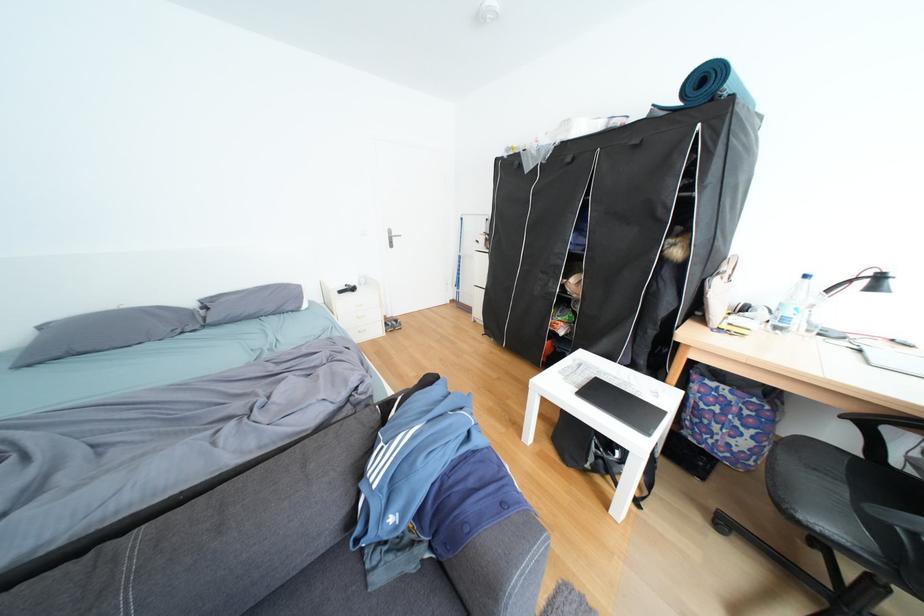
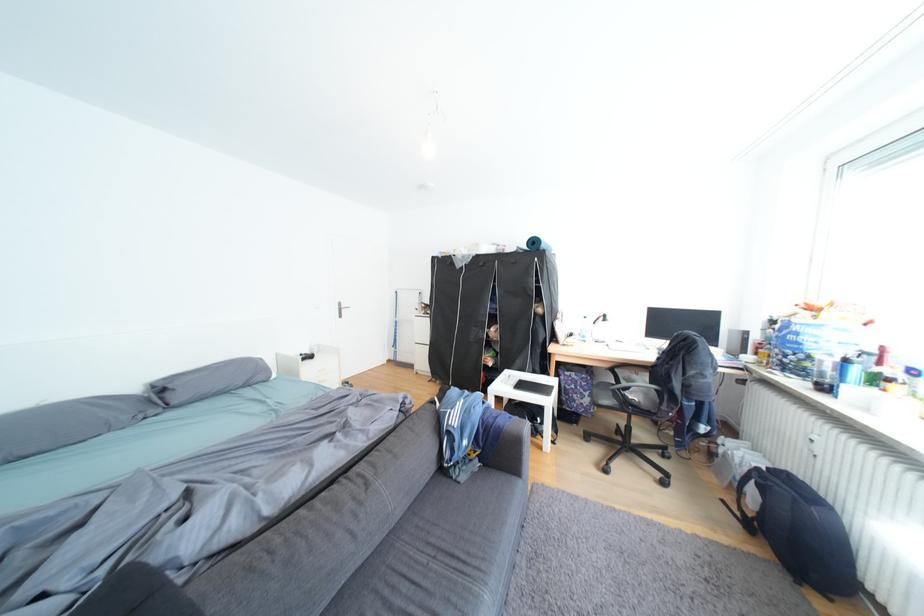
Locate, in the second image, the point that corresponds to (94,350) in the first image.

(40, 453)